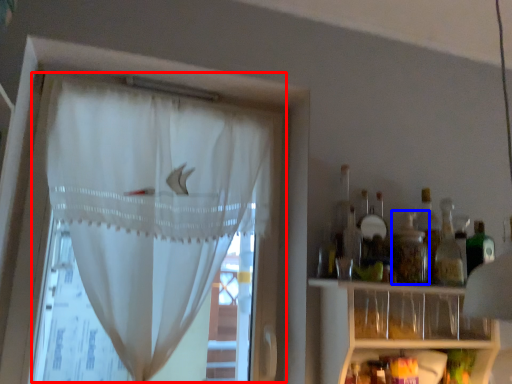
Question: Which object appears closest to the camera in this image, curtain (highlighted by a red box) or bottle (highlighted by a blue box)?

Choices:
 (A) curtain
 (B) bottle

Answer: (A)